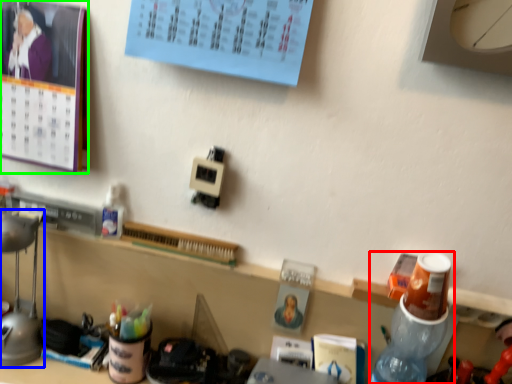
Question: Which object is the closest to the bottle (highlighted by a red box)? Choose among these: lamp (highlighted by a blue box) or bulletin board (highlighted by a green box).

Choices:
 (A) lamp
 (B) bulletin board

Answer: (B)